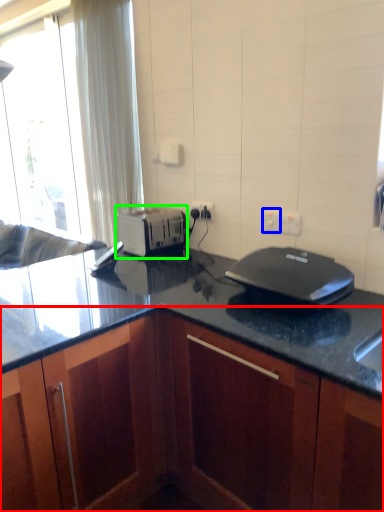
Question: Which object is positioned closest to cabinetry (highlighted by a red box)? Select from electric outlet (highlighted by a blue box) and toaster (highlighted by a green box).

Choices:
 (A) electric outlet
 (B) toaster

Answer: (B)